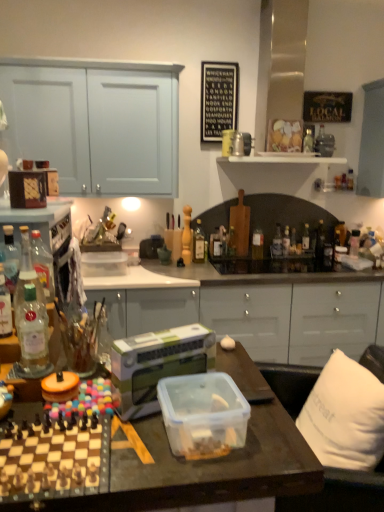
This screenshot has width=384, height=512. Find the location of `free space in front of translucent glass bottle at center, the 3th bottle positioned from the right`. free space in front of translucent glass bottle at center, the 3th bottle positioned from the right is located at coordinates (294, 264).